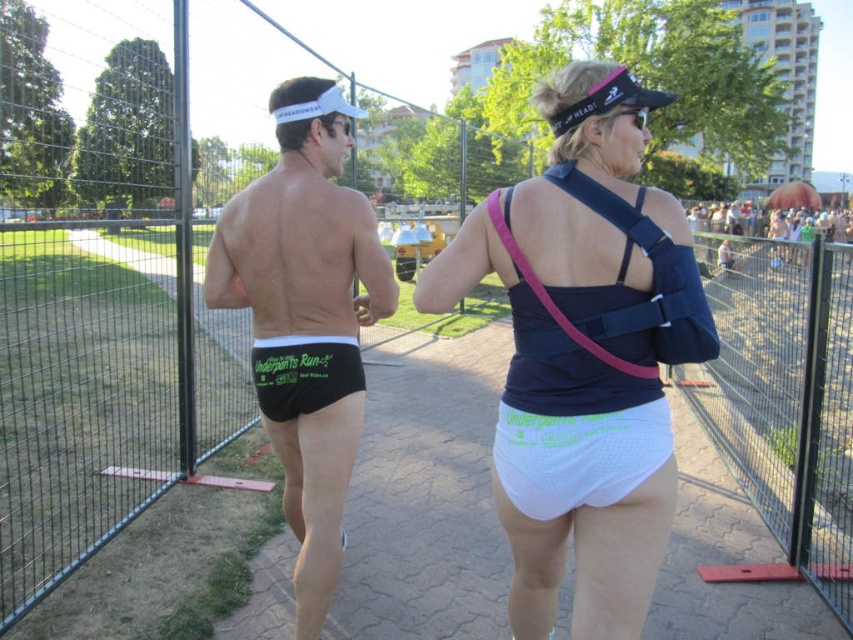
Question: Which of the following is the farthest from the observer?

Choices:
 (A) (287, 419)
 (B) (547, 291)
 (C) (744, 262)

Answer: (C)

Question: Which point is farther from the camera taking this photo?

Choices:
 (A) (350, 348)
 (B) (578, 426)
 (C) (103, 120)
 (D) (735, 262)

Answer: (C)

Question: Can you confirm if black matte underwear at center is positioned to the right of white mesh underwear at lower center?

Choices:
 (A) yes
 (B) no

Answer: (B)

Question: Can you confirm if metal fence at right is wider than black mesh shorts at center?

Choices:
 (A) no
 (B) yes

Answer: (B)

Question: Is white matte underwear at center positioned in front of metal fence at right?

Choices:
 (A) yes
 (B) no

Answer: (A)

Question: Considering the real-world distances, which object is closest to the white mesh underwear at center?

Choices:
 (A) white matte underwear at center
 (B) black matte underwear at center
 (C) white mesh underwear at lower center
 (D) metal fence at center

Answer: (A)